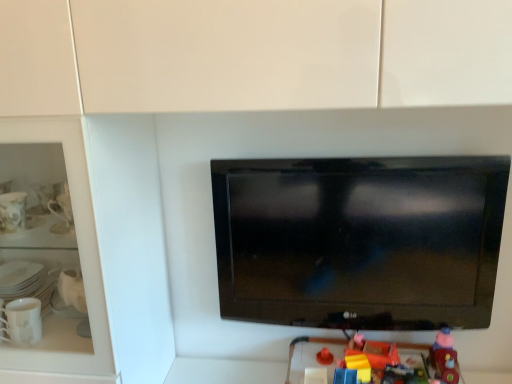
Question: In terms of width, does matte plastic toy at lower right, which is counted as the first toy, starting from the right, look wider or thinner when compared to black glossy tv at center?

Choices:
 (A) wide
 (B) thin

Answer: (A)

Question: Visually, is matte plastic toy at lower right, which is counted as the first toy, starting from the right, positioned to the left or to the right of black glossy tv at center?

Choices:
 (A) right
 (B) left

Answer: (A)

Question: Estimate the real-world distances between objects in this image. Which object is closer to the black glossy tv at center?

Choices:
 (A) rubberized plastic toy at lower center, which is the second toy in left-to-right order
 (B) matte plastic toy at lower right, which is counted as the first toy, starting from the right
 (C) rubberized plastic toy at lower right, placed as the 1th toy when sorted from left to right

Answer: (C)

Question: Considering the real-world distances, which object is closest to the black glossy tv at center?

Choices:
 (A) rubberized plastic toy at lower right, placed as the 1th toy when sorted from left to right
 (B) rubberized plastic toy at lower center, which is the second toy in left-to-right order
 (C) matte plastic toy at lower right, the third toy in the left-to-right sequence

Answer: (A)